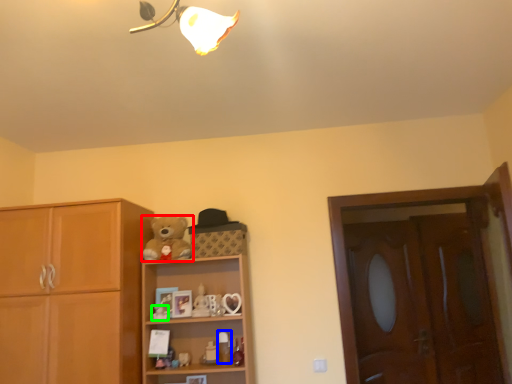
Question: Considering the real-world distances, which object is farthest from teddy bear (highlighted by a red box)? toy (highlighted by a blue box) or toy (highlighted by a green box)?

Choices:
 (A) toy
 (B) toy

Answer: (A)